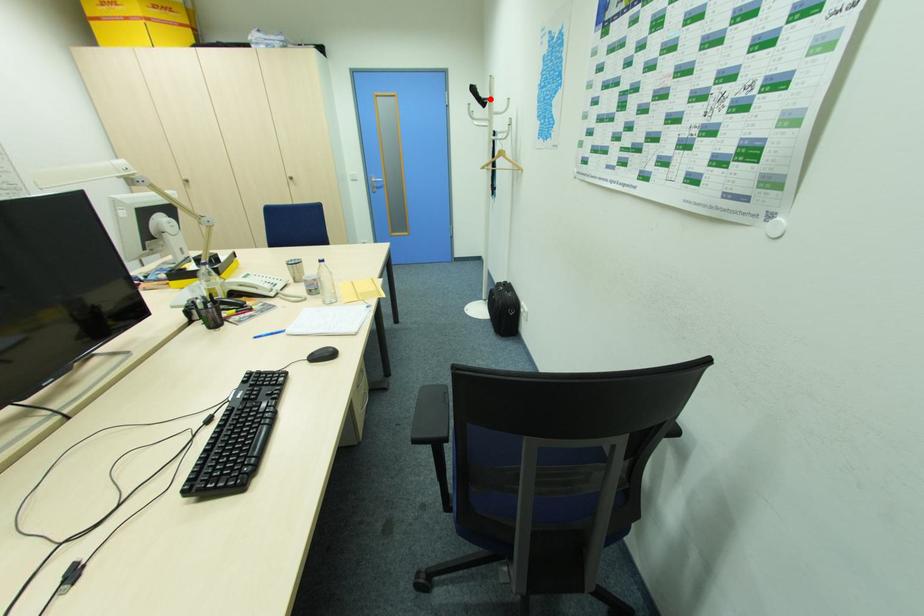
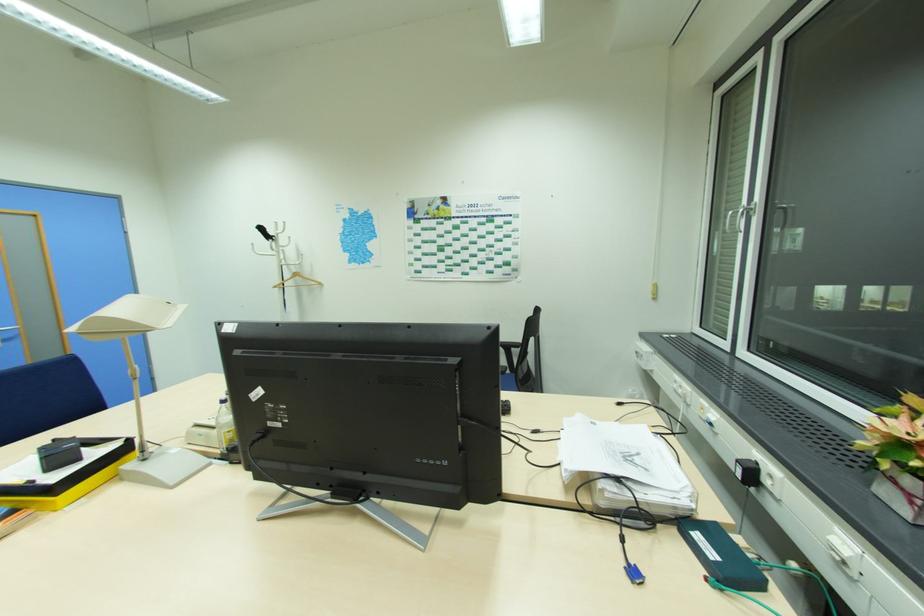
In the second image, find the point that corresponds to the highlighted location in the first image.

(276, 237)